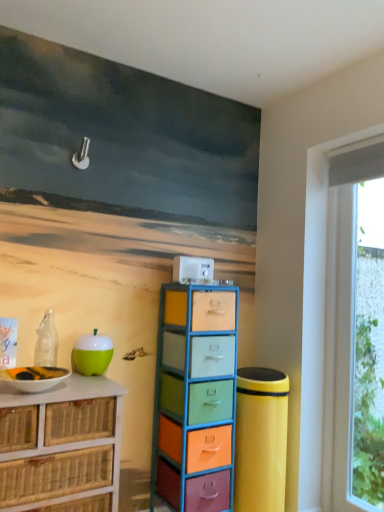
Question: Can you confirm if transparent glass window at right is shorter than multicolored plastic drawers at center, arranged as the 2th chest of drawers when viewed from the left?

Choices:
 (A) no
 (B) yes

Answer: (A)

Question: Would you say transparent glass window at right is outside multicolored plastic drawers at center, arranged as the 2th chest of drawers when viewed from the left?

Choices:
 (A) yes
 (B) no

Answer: (A)

Question: From the image's perspective, would you say transparent glass window at right is positioned over multicolored plastic drawers at center, which appears as the 1th chest of drawers when viewed from the right?

Choices:
 (A) no
 (B) yes

Answer: (B)

Question: Does transparent glass window at right lie behind multicolored plastic drawers at center, which appears as the 1th chest of drawers when viewed from the right?

Choices:
 (A) no
 (B) yes

Answer: (B)

Question: Is transparent glass window at right taller than multicolored plastic drawers at center, which appears as the 1th chest of drawers when viewed from the right?

Choices:
 (A) no
 (B) yes

Answer: (B)

Question: Is point (59, 372) closer or farther from the camera than point (354, 222)?

Choices:
 (A) closer
 (B) farther

Answer: (A)

Question: From their relative heights in the image, would you say white glossy bowl at lower left is taller or shorter than transparent glass window at right?

Choices:
 (A) tall
 (B) short

Answer: (B)

Question: From the image's perspective, is white glossy bowl at lower left positioned above or below transparent glass window at right?

Choices:
 (A) above
 (B) below

Answer: (A)

Question: In the image, is white glossy bowl at lower left on the left side or the right side of transparent glass window at right?

Choices:
 (A) left
 (B) right

Answer: (A)

Question: Considering the positions of transparent glass window at right and white glossy bowl at lower left in the image, is transparent glass window at right taller or shorter than white glossy bowl at lower left?

Choices:
 (A) tall
 (B) short

Answer: (A)

Question: Considering the positions of transparent glass window at right and white glossy bowl at lower left in the image, is transparent glass window at right wider or thinner than white glossy bowl at lower left?

Choices:
 (A) wide
 (B) thin

Answer: (B)

Question: From a real-world perspective, relative to white glossy bowl at lower left, is transparent glass window at right vertically above or below?

Choices:
 (A) above
 (B) below

Answer: (A)

Question: Is transparent glass window at right in front of or behind white glossy bowl at lower left in the image?

Choices:
 (A) front
 (B) behind

Answer: (B)

Question: In the image, is multicolored plastic drawers at center, which appears as the 1th chest of drawers when viewed from the right, positioned in front of or behind white glossy bowl at lower left?

Choices:
 (A) front
 (B) behind

Answer: (B)

Question: From the image's perspective, relative to white glossy bowl at lower left, is multicolored plastic drawers at center, which appears as the 1th chest of drawers when viewed from the right, above or below?

Choices:
 (A) above
 (B) below

Answer: (B)